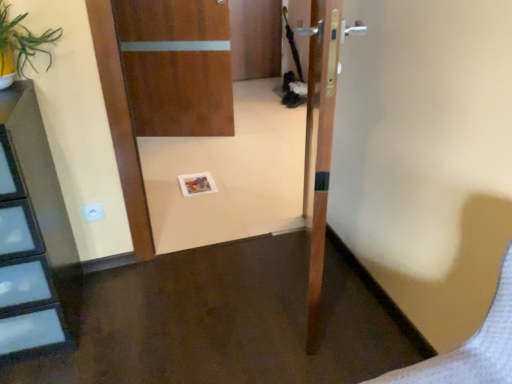
The width and height of the screenshot is (512, 384). Find the location of `wooden door at center, the 2th door viewed from the right`. wooden door at center, the 2th door viewed from the right is located at coordinates (177, 66).

You are a GUI agent. You are given a task and a screenshot of the screen. Output one action in this format:
    pyautogui.click(x=<x>, y=<y>)
    Task: Click on the wooden door at center, which is counted as the second door, starting from the back
    The height and width of the screenshot is (384, 512).
    Given the screenshot: What is the action you would take?
    pyautogui.click(x=320, y=139)

Locate an element on the screen. The height and width of the screenshot is (384, 512). green leafy plant at upper left is located at coordinates (21, 42).

At what (x,y) coordinates should I click in order to perform the action: click on white plastic electric outlet at lower left. Please return your answer as a coordinate pair (x, y). The width and height of the screenshot is (512, 384). Looking at the image, I should click on (93, 212).

Which point is more distant from viewer, [32,66] or [341,5]?

The point [32,66] is behind.

Considering the sizes of objects green leafy plant at upper left and wooden door at center, marked as the first door in a front-to-back arrangement, in the image provided, who is bigger, green leafy plant at upper left or wooden door at center, marked as the first door in a front-to-back arrangement,?

wooden door at center, marked as the first door in a front-to-back arrangement, is bigger.

From the image's perspective, is green leafy plant at upper left located above wooden door at center, which ranks as the first door in right-to-left order?

Yes, from the image's perspective, green leafy plant at upper left is on top of wooden door at center, which ranks as the first door in right-to-left order.

Can you confirm if wooden door at center, which is counted as the second door, starting from the back, is thinner than wooden door at center, placed as the 1th door when sorted from back to front?

No.

Does point (337, 27) appear closer or farther from the camera than point (136, 134)?

Point (337, 27) is closer to the camera than point (136, 134).

Can you confirm if wooden door at center, which is counted as the second door, starting from the back, is bigger than wooden door at center, the 2th door from the front?

Yes, wooden door at center, which is counted as the second door, starting from the back, is bigger than wooden door at center, the 2th door from the front.

Would you say wooden door at center, which is counted as the second door, starting from the back, is to the left or to the right of white plastic electric outlet at lower left in the picture?

From the image, it's evident that wooden door at center, which is counted as the second door, starting from the back, is to the right of white plastic electric outlet at lower left.

Is wooden door at center, which ranks as the first door in right-to-left order, directly adjacent to white plastic electric outlet at lower left?

wooden door at center, which ranks as the first door in right-to-left order, and white plastic electric outlet at lower left are not in contact.

At what (x,y) coordinates should I click in order to perform the action: click on electric outlet located on the left of wooden door at center, the second door when ordered from left to right. Please return your answer as a coordinate pair (x, y). The height and width of the screenshot is (384, 512). Looking at the image, I should click on (93, 212).

From the picture: From the image's perspective, is wooden door at center, which ranks as the first door in right-to-left order, over white plastic electric outlet at lower left?

Yes, from the image's perspective, wooden door at center, which ranks as the first door in right-to-left order, is over white plastic electric outlet at lower left.

How many degrees apart are the facing directions of wooden door at center, marked as the first door in a front-to-back arrangement, and green leafy plant at upper left?

The facing directions of wooden door at center, marked as the first door in a front-to-back arrangement, and green leafy plant at upper left are 111 degrees apart.

Between point (312, 295) and point (57, 32), which one is positioned in front?

The point (312, 295) is in front.

Find the location of a particular element. plant located on the left of wooden door at center, the second door when ordered from left to right is located at coordinates click(21, 42).

Can you tell me how much wooden door at center, arranged as the 1th door when viewed from the left, and white plastic electric outlet at lower left differ in facing direction?

The angle between the facing direction of wooden door at center, arranged as the 1th door when viewed from the left, and the facing direction of white plastic electric outlet at lower left is 19.4 degrees.

Is wooden door at center, placed as the 1th door when sorted from back to front, next to white plastic electric outlet at lower left and touching it?

No, wooden door at center, placed as the 1th door when sorted from back to front, is not next to white plastic electric outlet at lower left.

Is wooden door at center, placed as the 1th door when sorted from back to front, inside the boundaries of white plastic electric outlet at lower left, or outside?

The correct answer is: outside.

From the image's perspective, starting from the white plastic electric outlet at lower left, which door is the 2nd one above? Please provide its 2D coordinates.

[(177, 66)]

Is white plastic electric outlet at lower left in contact with green leafy plant at upper left?

white plastic electric outlet at lower left and green leafy plant at upper left are clearly separated.

Is white plastic electric outlet at lower left in front of or behind green leafy plant at upper left in the image?

white plastic electric outlet at lower left is behind green leafy plant at upper left.

Can you confirm if white plastic electric outlet at lower left is thinner than green leafy plant at upper left?

Yes, white plastic electric outlet at lower left is thinner than green leafy plant at upper left.

Can you confirm if wooden door at center, arranged as the 1th door when viewed from the left, is taller than wooden door at center, marked as the first door in a front-to-back arrangement?

In fact, wooden door at center, arranged as the 1th door when viewed from the left, may be shorter than wooden door at center, marked as the first door in a front-to-back arrangement.

Could you tell me if wooden door at center, placed as the 1th door when sorted from back to front, is facing wooden door at center, the second door when ordered from left to right?

Yes, wooden door at center, placed as the 1th door when sorted from back to front, is aimed at wooden door at center, the second door when ordered from left to right.

Considering the relative sizes of wooden door at center, the 2th door viewed from the right, and wooden door at center, which ranks as the first door in right-to-left order, in the image provided, is wooden door at center, the 2th door viewed from the right, wider than wooden door at center, which ranks as the first door in right-to-left order,?

Incorrect, the width of wooden door at center, the 2th door viewed from the right, does not surpass that of wooden door at center, which ranks as the first door in right-to-left order.

From the picture: Is the position of wooden door at center, the 2th door from the front, less distant than that of wooden door at center, which ranks as the first door in right-to-left order?

No, it is not.

At what (x,y) coordinates should I click in order to perform the action: click on door that is below the green leafy plant at upper left (from the image's perspective). Please return your answer as a coordinate pair (x, y). Image resolution: width=512 pixels, height=384 pixels. Looking at the image, I should click on (320, 139).

Where is `door on the left side of wooden door at center, which is counted as the second door, starting from the back`? The image size is (512, 384). door on the left side of wooden door at center, which is counted as the second door, starting from the back is located at coordinates (177, 66).

When comparing their distances from wooden door at center, the 2th door viewed from the right, does wooden door at center, marked as the first door in a front-to-back arrangement, or green leafy plant at upper left seem further?

green leafy plant at upper left.

Based on their spatial positions, is wooden door at center, marked as the first door in a front-to-back arrangement, or wooden door at center, arranged as the 1th door when viewed from the left, closer to green leafy plant at upper left?

wooden door at center, marked as the first door in a front-to-back arrangement, lies closer to green leafy plant at upper left than the other object.

From the image, which object appears to be farther from wooden door at center, the 2th door from the front, green leafy plant at upper left or white plastic electric outlet at lower left?

green leafy plant at upper left is further to wooden door at center, the 2th door from the front.

Which object lies further to the anchor point white plastic electric outlet at lower left, wooden door at center, the 2th door viewed from the right, or wooden door at center, which ranks as the first door in right-to-left order?

wooden door at center, the 2th door viewed from the right, is further to white plastic electric outlet at lower left.

Based on their spatial positions, is wooden door at center, which is counted as the second door, starting from the back, or wooden door at center, arranged as the 1th door when viewed from the left, further from white plastic electric outlet at lower left?

The object further to white plastic electric outlet at lower left is wooden door at center, arranged as the 1th door when viewed from the left.

Considering their positions, is white plastic electric outlet at lower left positioned further to green leafy plant at upper left than wooden door at center, arranged as the 1th door when viewed from the left?

wooden door at center, arranged as the 1th door when viewed from the left, lies further to green leafy plant at upper left than the other object.

Estimate the real-world distances between objects in this image. Which object is closer to white plastic electric outlet at lower left, wooden door at center, which ranks as the first door in right-to-left order, or green leafy plant at upper left?

green leafy plant at upper left is positioned closer to the anchor white plastic electric outlet at lower left.

Looking at this image, from the image, which object appears to be farther from white plastic electric outlet at lower left, green leafy plant at upper left or wooden door at center, the second door when ordered from left to right?

Among the two, wooden door at center, the second door when ordered from left to right, is located further to white plastic electric outlet at lower left.

I want to click on electric outlet located between wooden door at center, which ranks as the first door in right-to-left order, and wooden door at center, the 2th door viewed from the right, in the depth direction, so [93, 212].

Identify the location of electric outlet between green leafy plant at upper left and wooden door at center, marked as the first door in a front-to-back arrangement, from left to right. (93, 212).

Locate an element on the screen. This screenshot has width=512, height=384. plant between wooden door at center, which is counted as the second door, starting from the back, and wooden door at center, the 2th door from the front, in the front-back direction is located at coordinates (21, 42).

This screenshot has height=384, width=512. I want to click on electric outlet between green leafy plant at upper left and wooden door at center, arranged as the 1th door when viewed from the left, along the z-axis, so click(93, 212).